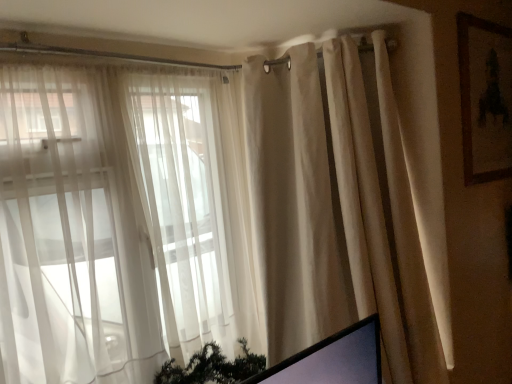
Question: Does beige fabric curtain at right have a greater height compared to sheer white curtains at left?

Choices:
 (A) no
 (B) yes

Answer: (B)

Question: Is beige fabric curtain at right located outside sheer white curtains at left?

Choices:
 (A) no
 (B) yes

Answer: (B)

Question: Is beige fabric curtain at right thinner than sheer white curtains at left?

Choices:
 (A) no
 (B) yes

Answer: (A)

Question: From the image's perspective, is beige fabric curtain at right beneath sheer white curtains at left?

Choices:
 (A) no
 (B) yes

Answer: (B)

Question: Is beige fabric curtain at right at the left side of sheer white curtains at left?

Choices:
 (A) yes
 (B) no

Answer: (B)

Question: Does beige fabric curtain at right have a smaller size compared to sheer white curtains at left?

Choices:
 (A) no
 (B) yes

Answer: (A)

Question: From a real-world perspective, is sheer white curtains at left beneath beige fabric curtain at right?

Choices:
 (A) yes
 (B) no

Answer: (B)

Question: Is sheer white curtains at left surrounding beige fabric curtain at right?

Choices:
 (A) no
 (B) yes

Answer: (A)

Question: Would you say sheer white curtains at left is outside beige fabric curtain at right?

Choices:
 (A) no
 (B) yes

Answer: (B)

Question: Does sheer white curtains at left have a smaller size compared to beige fabric curtain at right?

Choices:
 (A) no
 (B) yes

Answer: (B)

Question: Can you confirm if sheer white curtains at left is bigger than beige fabric curtain at right?

Choices:
 (A) no
 (B) yes

Answer: (A)

Question: Does sheer white curtains at left have a lesser width compared to beige fabric curtain at right?

Choices:
 (A) yes
 (B) no

Answer: (A)

Question: Could you tell me if brown wooden picture frame at upper right is facing sheer white curtains at left?

Choices:
 (A) no
 (B) yes

Answer: (A)